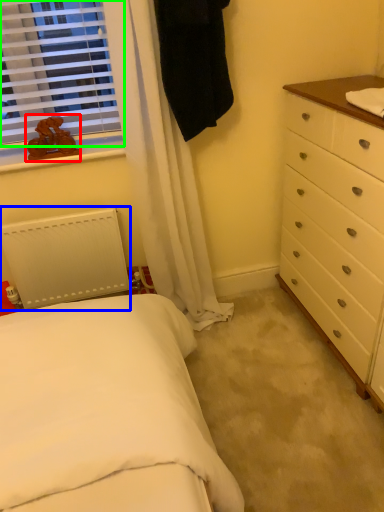
Question: Based on their relative distances, which object is nearer to toy (highlighted by a red box)? Choose from radiator (highlighted by a blue box) and window (highlighted by a green box).

Choices:
 (A) radiator
 (B) window

Answer: (B)